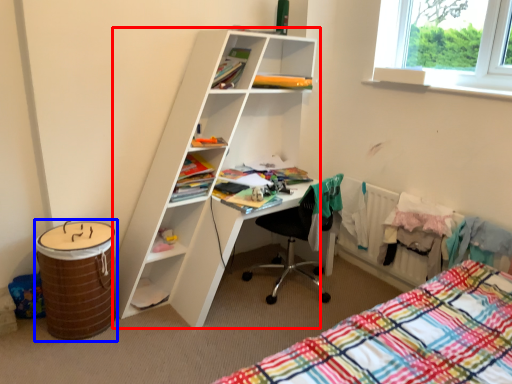
Question: Among these objects, which one is nearest to the camera, shelf (highlighted by a red box) or barrel (highlighted by a blue box)?

Choices:
 (A) shelf
 (B) barrel

Answer: (A)